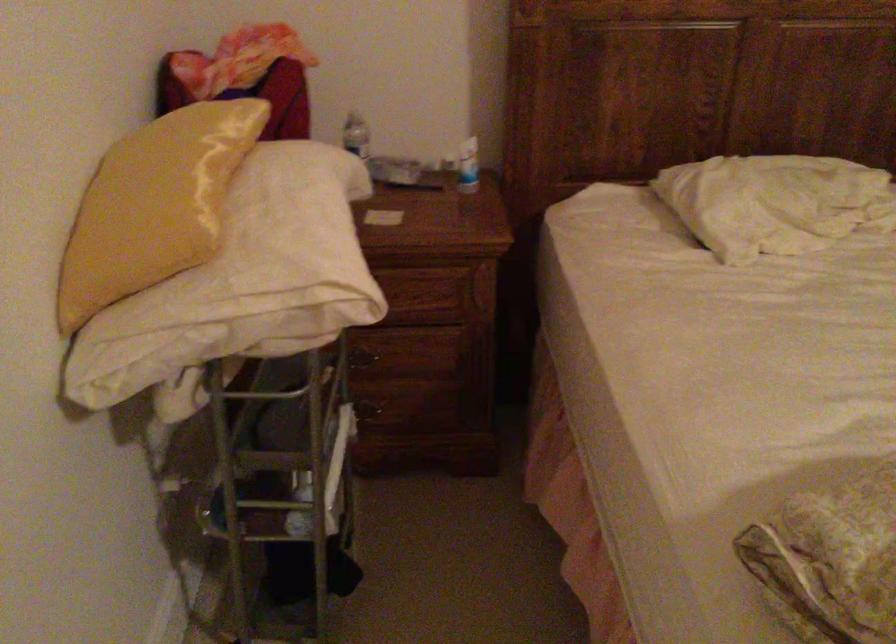
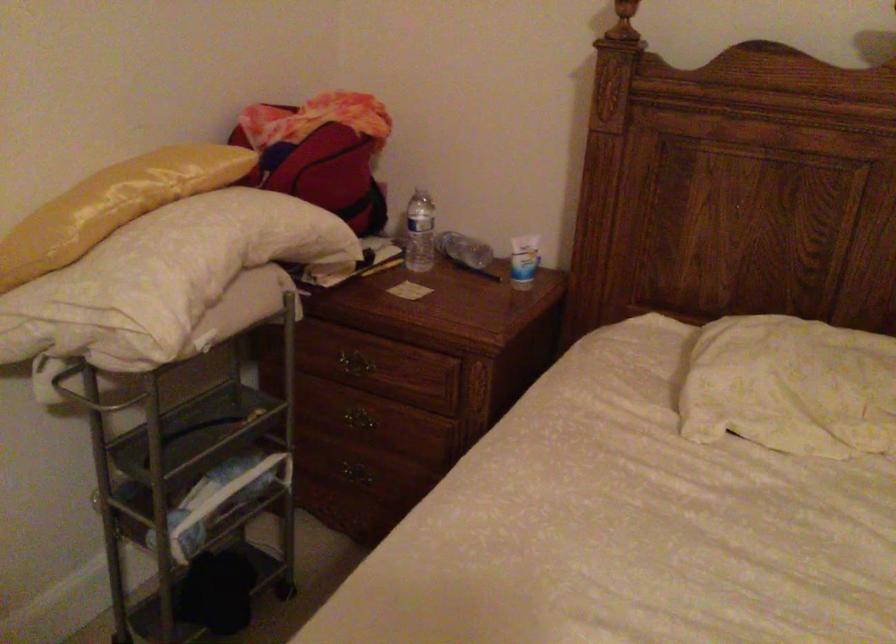
Question: The images are taken continuously from a first-person perspective. In which direction is your viewpoint rotating?

Choices:
 (A) Left
 (B) Right
 (C) Up
 (D) Down

Answer: (A)